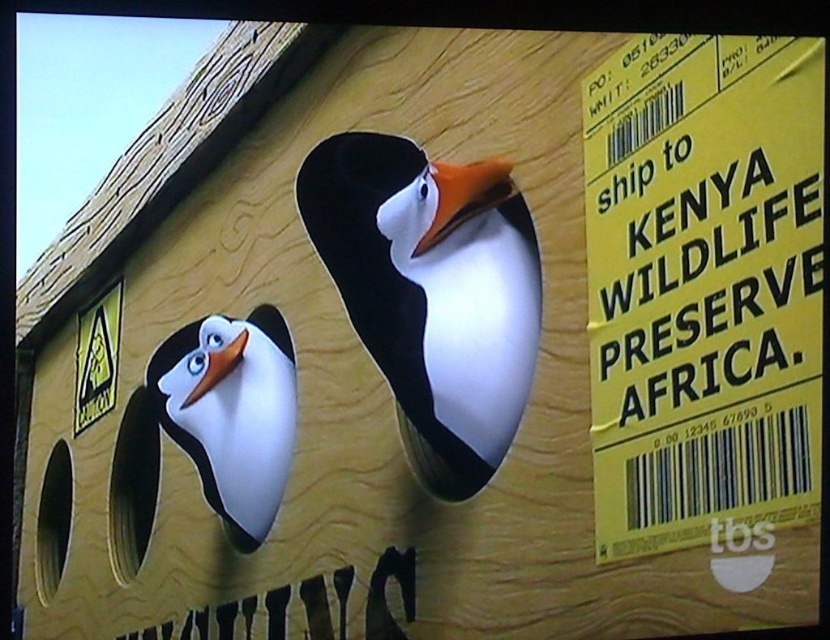
Does yellow paper at right have a lesser width compared to orange matte beak at center?

In fact, yellow paper at right might be wider than orange matte beak at center.

Does yellow paper at right appear on the left side of orange matte beak at center?

In fact, yellow paper at right is to the right of orange matte beak at center.

Between point (692, 292) and point (486, 188), which one is positioned in front?

Positioned in front is point (692, 292).

The height and width of the screenshot is (640, 830). I want to click on yellow paper at right, so click(x=702, y=289).

Does white matte penguin at center come behind matte orange beak at left?

No, white matte penguin at center is closer to the viewer.

From the picture: Does white matte penguin at center have a lesser height compared to matte orange beak at left?

Incorrect, white matte penguin at center's height does not fall short of matte orange beak at left's.

Does point (448, 176) come behind point (215, 358)?

No, it is not.

Where is `white matte penguin at center`? The height and width of the screenshot is (640, 830). white matte penguin at center is located at coordinates (432, 292).

Is yellow paper at right to the left of matte orange beak at left from the viewer's perspective?

No, yellow paper at right is not to the left of matte orange beak at left.

Is point (597, 74) behind point (230, 340)?

No, it is not.

At what (x,y) coordinates should I click in order to perform the action: click on yellow paper at right. Please return your answer as a coordinate pair (x, y). Looking at the image, I should click on (702, 289).